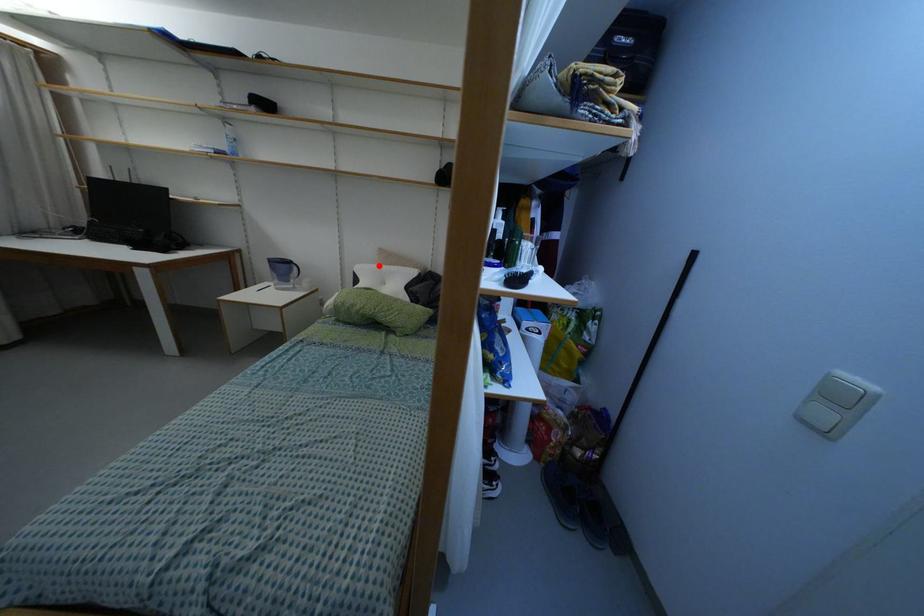
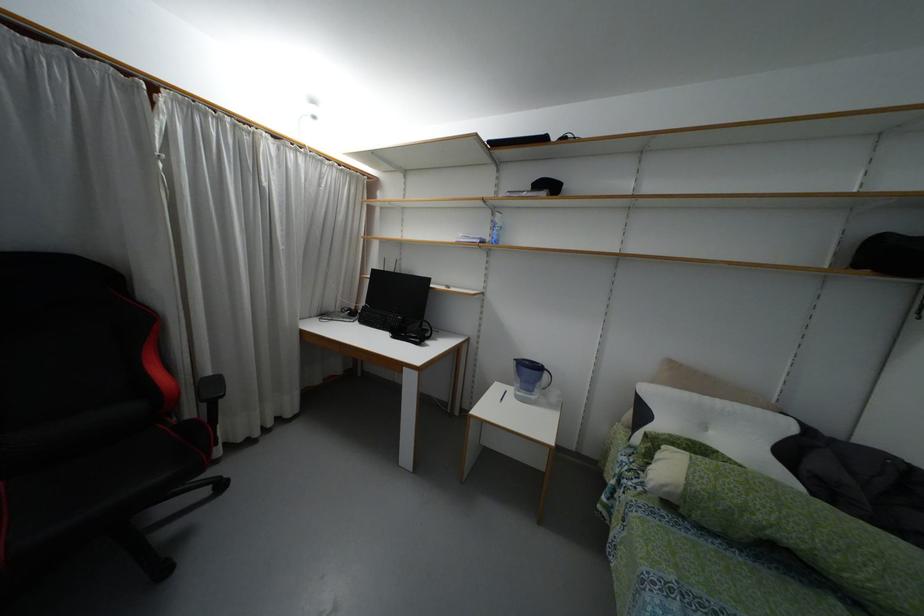
Locate, in the second image, the point that corresponds to the highlighted location in the first image.

(695, 395)